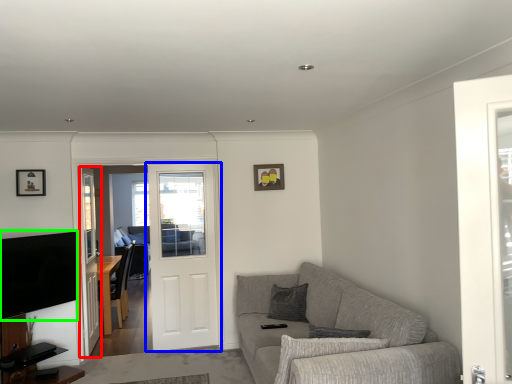
Question: Estimate the real-world distances between objects in this image. Which object is farther from screen door (highlighted by a red box), door (highlighted by a blue box) or television (highlighted by a green box)?

Choices:
 (A) door
 (B) television

Answer: (A)